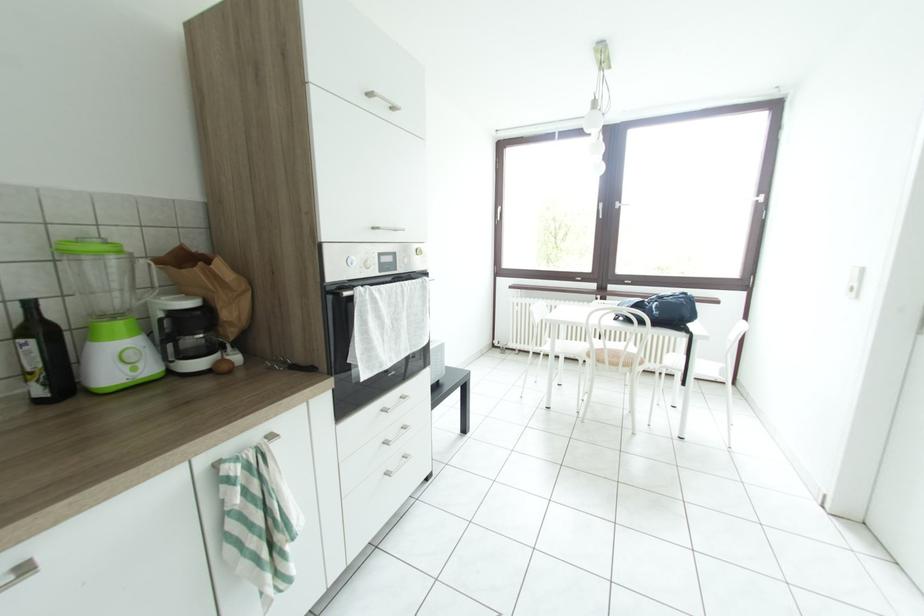
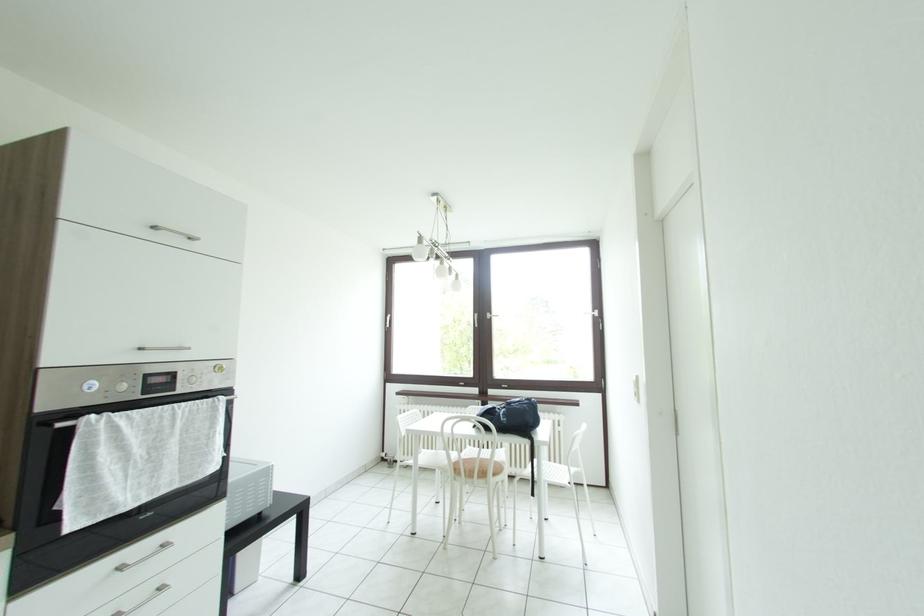
Question: The images are taken continuously from a first-person perspective. In which direction are you moving?

Choices:
 (A) Left
 (B) Right
 (C) Forward
 (D) Backward

Answer: (B)